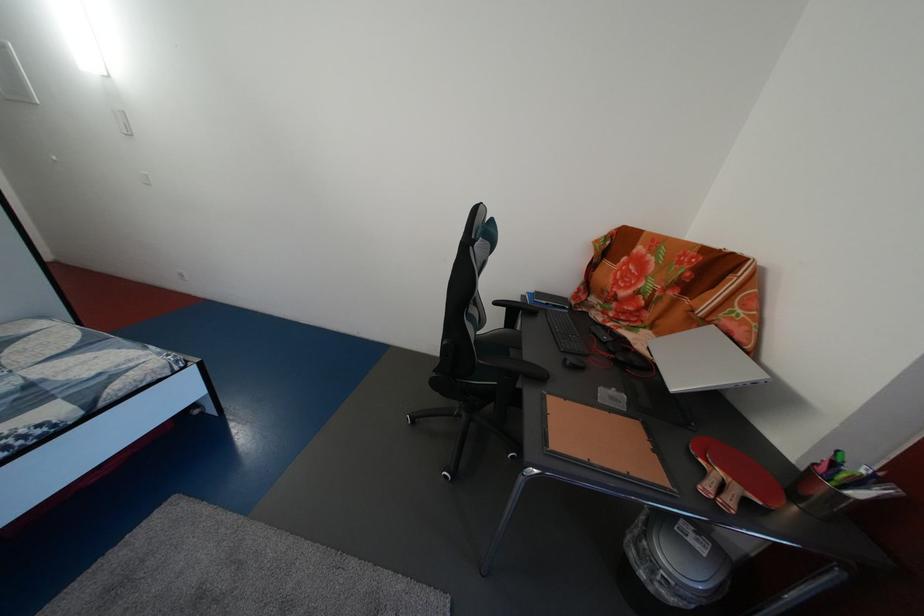
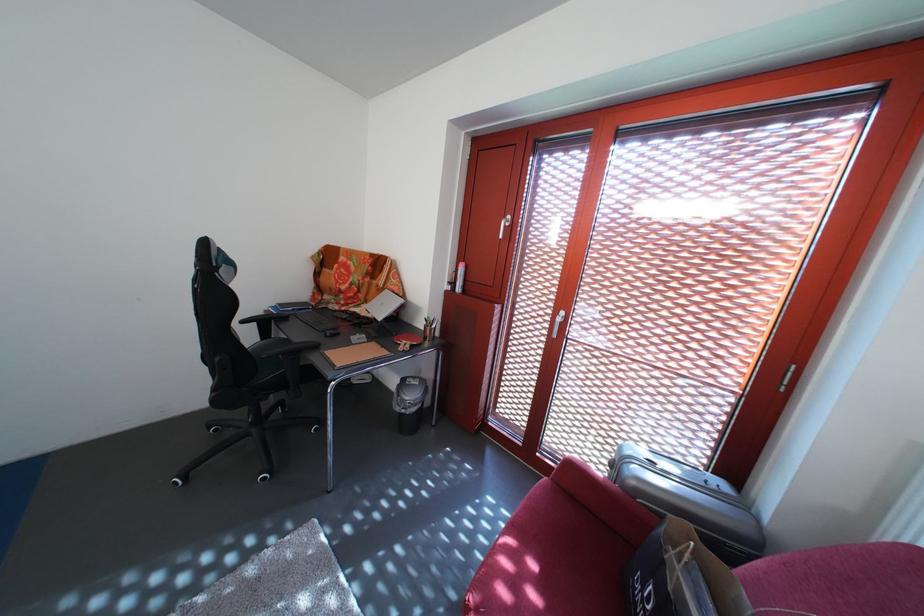
Find the pixel in the second image that matches (520,328) in the first image.

(275, 339)